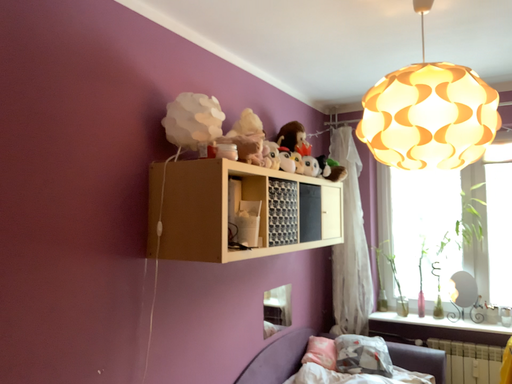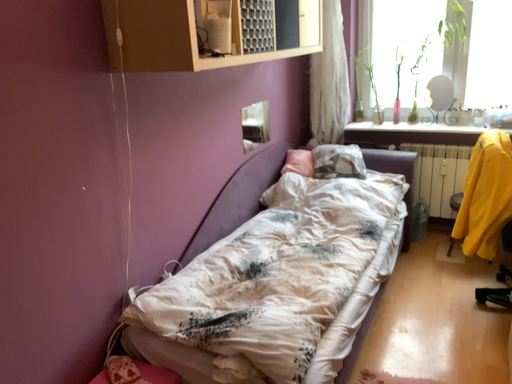
Question: How did the camera likely rotate when shooting the video?

Choices:
 (A) rotated downward
 (B) rotated upward

Answer: (A)